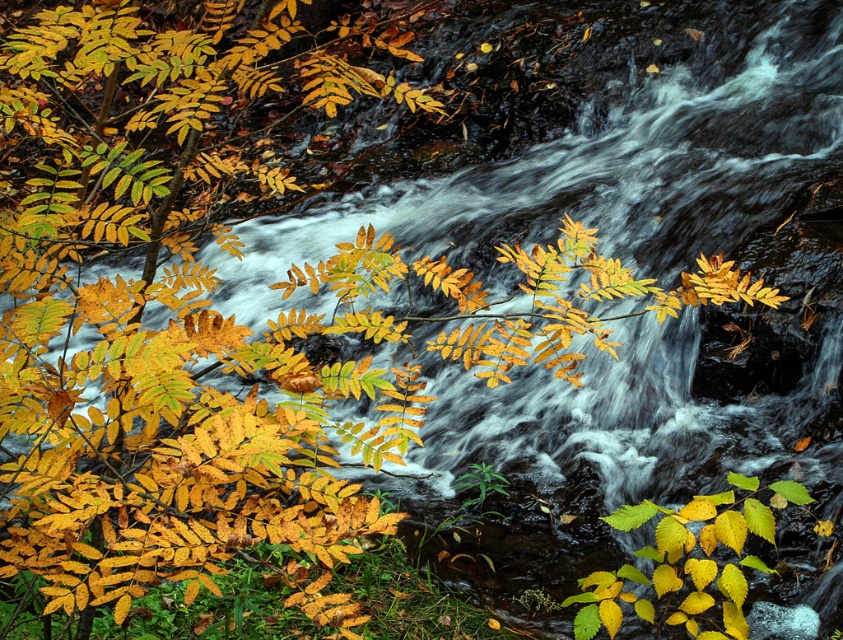
You are an artist sketching the autumn scene. You notice the yellow matte leaf at center and the green glossy leaf at lower center. Which leaf is closer to your viewpoint?

The yellow matte leaf at center is closer to your viewpoint because it is in front of the green glossy leaf at lower center.

You are standing at the edge of the stream and notice a green glossy leaf at lower center. Can you determine its exact position relative to the stream?

The green glossy leaf at lower center is located at point (x=629, y=516), which places it near the lower part of the stream, slightly to the right side.